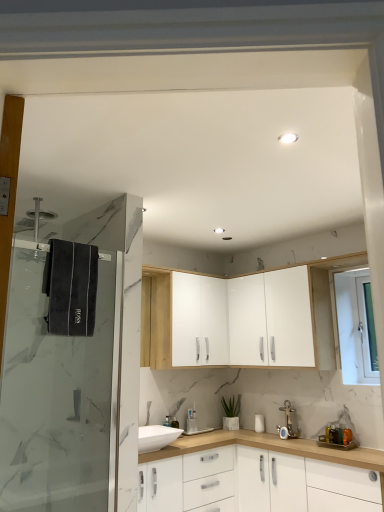
Question: Is white matte cabinet at center, acting as the 3th cabinetry starting from the top, taller or shorter than white glossy light fixture at upper center?

Choices:
 (A) short
 (B) tall

Answer: (B)

Question: Visually, is white matte cabinet at center, which is counted as the first cabinetry, starting from the bottom, positioned to the left or to the right of white glossy light fixture at upper center?

Choices:
 (A) right
 (B) left

Answer: (A)

Question: Based on their relative distances, which object is farther from the transparent glass shower door at left?

Choices:
 (A) green matte plant at lower center
 (B) white glossy cabinet at center, the 1th cabinetry in the top-to-bottom sequence
 (C) white glossy door at upper right
 (D) white glossy cabinet at upper center, positioned as the 2th cabinetry in top-to-bottom order
 (E) white matte cabinet at center, which is counted as the first cabinetry, starting from the bottom

Answer: (C)

Question: Which object is positioned farthest from the white glossy light fixture at upper center?

Choices:
 (A) white plastic window screen at upper right
 (B) white matte cabinet at center, which is counted as the first cabinetry, starting from the bottom
 (C) transparent glass shower door at left
 (D) white glossy cabinet at upper center, placed as the second cabinetry when sorted from bottom to top
 (E) green matte plant at lower center

Answer: (E)